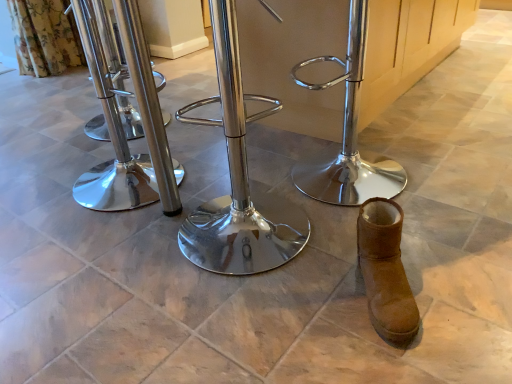
Locate an element on the screen. The height and width of the screenshot is (384, 512). vacant area on the back side of polished metal swivel chair at center, which is the second swivel chair from right to left is located at coordinates (246, 178).